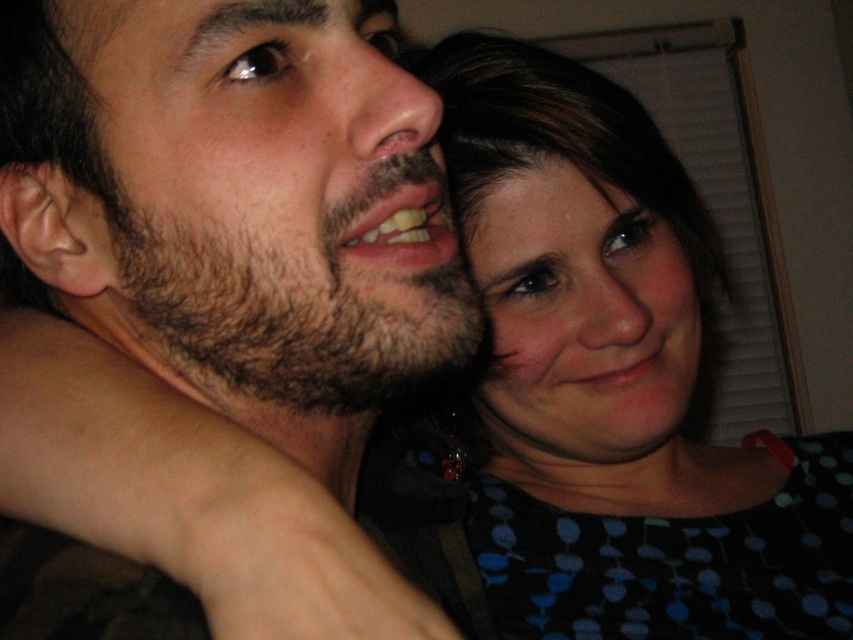
Is point (183, 378) farther from camera compared to point (646, 438)?

No, (183, 378) is closer to viewer.

Which is more to the left, dark brown hair at upper left or matte black hair at upper right?

dark brown hair at upper left is more to the left.

The width and height of the screenshot is (853, 640). I want to click on dark brown hair at upper left, so click(236, 205).

At what (x,y) coordinates should I click in order to perform the action: click on dark brown hair at upper left. Please return your answer as a coordinate pair (x, y). Image resolution: width=853 pixels, height=640 pixels. Looking at the image, I should click on (236, 205).

You are a GUI agent. You are given a task and a screenshot of the screen. Output one action in this format:
    pyautogui.click(x=<x>, y=<y>)
    Task: Click on the polka dot fabric at upper right
    The height and width of the screenshot is (640, 853).
    Given the screenshot: What is the action you would take?
    pyautogui.click(x=595, y=390)

Between point (476, 593) and point (567, 172), which one is positioned behind?

The point (567, 172) is behind.

The height and width of the screenshot is (640, 853). What are the coordinates of `polka dot fabric at upper right` in the screenshot? It's located at (595, 390).

Does point (589, 568) come farther from viewer compared to point (347, 492)?

Yes, point (589, 568) is farther from viewer.

Based on the photo, who is positioned more to the right, polka dot fabric at upper right or dark brown hair at upper left?

polka dot fabric at upper right

Between point (593, 236) and point (157, 237), which one is positioned behind?

The point (593, 236) is behind.

The height and width of the screenshot is (640, 853). Find the location of `polka dot fabric at upper right`. polka dot fabric at upper right is located at coordinates tap(595, 390).